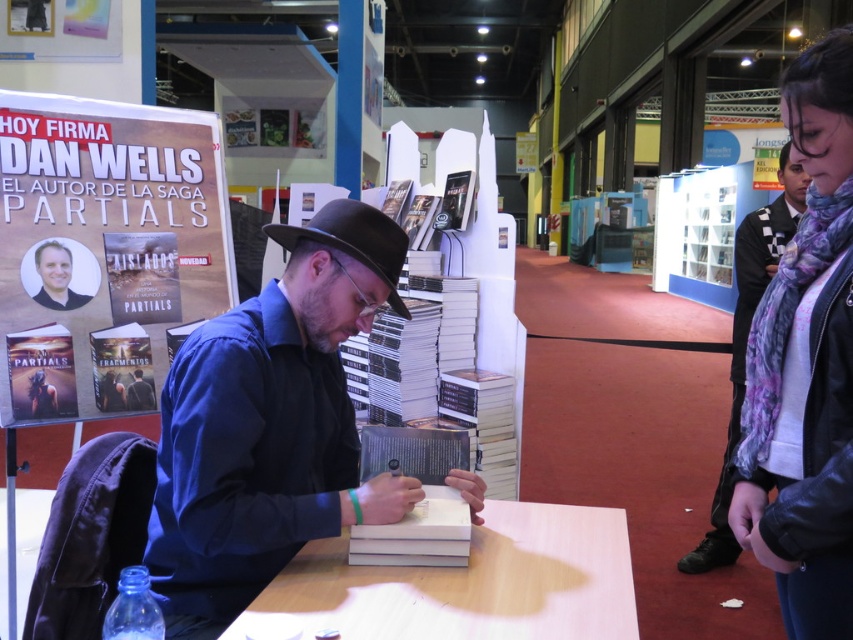
Does purple scarf at upper right come behind wooden table at center?

No.

Between point (781, 586) and point (407, 572), which one is positioned behind?

The point (781, 586) is behind.

Where is `purple scarf at upper right`? This screenshot has width=853, height=640. purple scarf at upper right is located at coordinates (805, 369).

Who is positioned more to the left, black matte shirt at center or white paper at center?

Positioned to the left is black matte shirt at center.

Is point (270, 372) farther from camera compared to point (413, 508)?

No, (270, 372) is in front of (413, 508).

At what (x,y) coordinates should I click in order to perform the action: click on black matte shirt at center. Please return your answer as a coordinate pair (x, y). Image resolution: width=853 pixels, height=640 pixels. Looking at the image, I should click on (270, 424).

Does wooden table at center appear on the left side of smooth skin portrait at center?

In fact, wooden table at center is to the right of smooth skin portrait at center.

Who is more distant from viewer, [424,620] or [85,300]?

The point [85,300] is more distant.

Who is more distant from viewer, (503,545) or (39,259)?

Point (39,259)

The image size is (853, 640). Find the location of `wooden table at center`. wooden table at center is located at coordinates (471, 582).